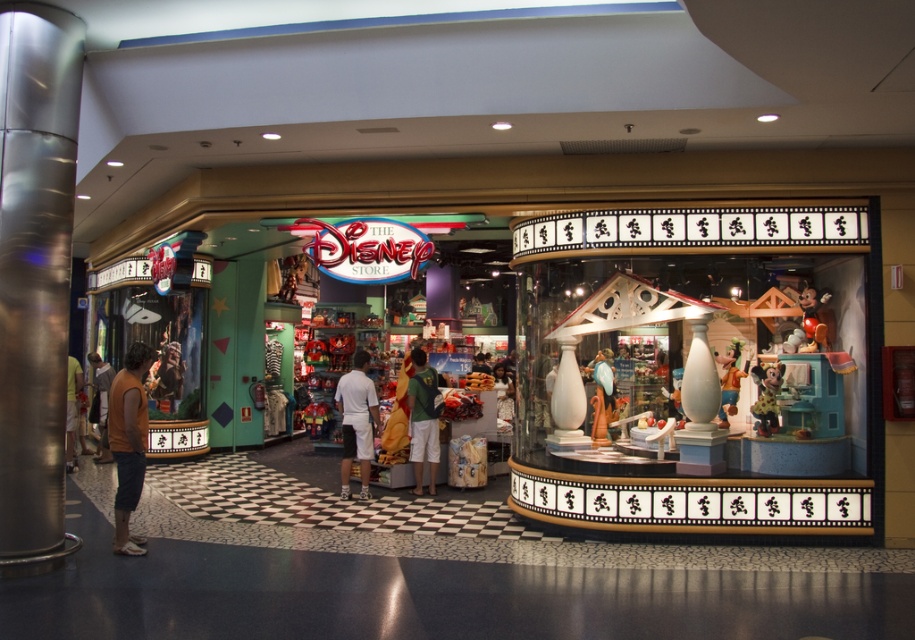
Does point (414, 353) lie behind point (109, 451)?

No.

Locate an element on the screen. green jersey at center is located at coordinates (422, 419).

Is point (428, 456) closer to camera compared to point (106, 461)?

Yes.

Locate an element on the screen. This screenshot has width=915, height=640. green jersey at center is located at coordinates click(422, 419).

Who is lower down, matte black display case at left or white cotton shorts at center?

white cotton shorts at center is lower down.

Which is in front, point (761, 353) or point (341, 410)?

Point (761, 353) is more forward.

At what (x,y) coordinates should I click in order to perform the action: click on matte black display case at left. Please return your answer as a coordinate pair (x, y). This screenshot has width=915, height=640. Looking at the image, I should click on (696, 369).

Is point (135, 470) positioned before point (429, 426)?

Yes, it is in front of point (429, 426).

Which is in front, point (117, 387) or point (418, 408)?

Point (117, 387)

Find the location of `orange sleeveless shirt at left`. orange sleeveless shirt at left is located at coordinates (128, 442).